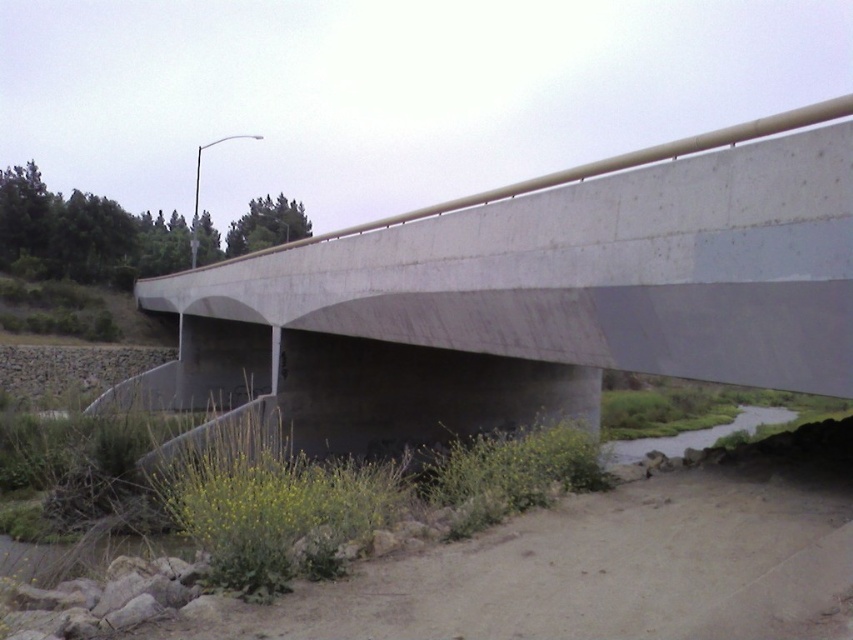
Can you confirm if concrete bridge at center is positioned above green grassy river at lower right?

Indeed, concrete bridge at center is positioned over green grassy river at lower right.

Where is `concrete bridge at center`? This screenshot has height=640, width=853. concrete bridge at center is located at coordinates (532, 298).

In order to click on concrete bridge at center in this screenshot , I will do `click(532, 298)`.